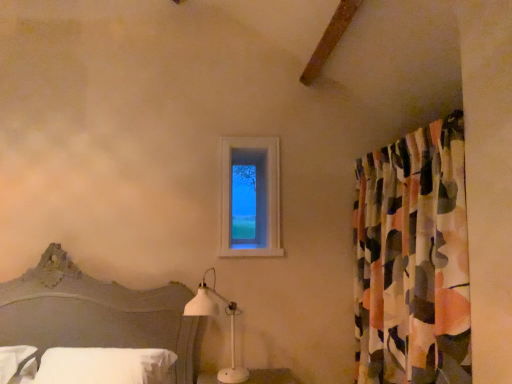
Question: Is white soft pillow at lower left smaller than white matte table lamp at lower center?

Choices:
 (A) yes
 (B) no

Answer: (B)

Question: From the image's perspective, is white soft pillow at lower left over white matte table lamp at lower center?

Choices:
 (A) yes
 (B) no

Answer: (B)

Question: From a real-world perspective, is white soft pillow at lower left on white matte table lamp at lower center?

Choices:
 (A) no
 (B) yes

Answer: (A)

Question: From a real-world perspective, is white soft pillow at lower left below white matte table lamp at lower center?

Choices:
 (A) no
 (B) yes

Answer: (B)

Question: Considering the relative sizes of white soft pillow at lower left and white matte table lamp at lower center in the image provided, is white soft pillow at lower left thinner than white matte table lamp at lower center?

Choices:
 (A) no
 (B) yes

Answer: (A)

Question: From the image's perspective, is matte gray headboard at lower left above or below white matte table lamp at lower center?

Choices:
 (A) below
 (B) above

Answer: (B)

Question: Based on their sizes in the image, would you say matte gray headboard at lower left is bigger or smaller than white matte table lamp at lower center?

Choices:
 (A) big
 (B) small

Answer: (A)

Question: From a real-world perspective, is matte gray headboard at lower left physically located above or below white matte table lamp at lower center?

Choices:
 (A) below
 (B) above

Answer: (B)

Question: Relative to white matte table lamp at lower center, is matte gray headboard at lower left in front or behind?

Choices:
 (A) behind
 (B) front

Answer: (B)

Question: Looking at their shapes, would you say white matte table lamp at lower center is wider or thinner than abstract fabric curtain at right?

Choices:
 (A) wide
 (B) thin

Answer: (A)

Question: In the image, is white matte table lamp at lower center positioned in front of or behind abstract fabric curtain at right?

Choices:
 (A) behind
 (B) front

Answer: (A)

Question: Is point (232, 352) closer or farther from the camera than point (385, 342)?

Choices:
 (A) farther
 (B) closer

Answer: (A)

Question: From the image's perspective, is white matte table lamp at lower center above or below abstract fabric curtain at right?

Choices:
 (A) above
 (B) below

Answer: (B)

Question: From a real-world perspective, is clear glass window at upper center above or below white soft pillow at lower left?

Choices:
 (A) below
 (B) above

Answer: (B)

Question: Is clear glass window at upper center to the left or to the right of white soft pillow at lower left in the image?

Choices:
 (A) right
 (B) left

Answer: (A)